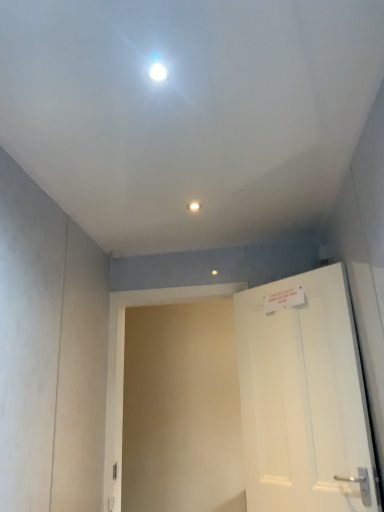
Describe the element at coordinates (194, 206) in the screenshot. I see `matte white light fixture at center` at that location.

Locate an element on the screen. This screenshot has height=512, width=384. matte white light fixture at center is located at coordinates (194, 206).

Image resolution: width=384 pixels, height=512 pixels. Describe the element at coordinates (304, 397) in the screenshot. I see `white matte door at right` at that location.

You are a GUI agent. You are given a task and a screenshot of the screen. Output one action in this format:
    pyautogui.click(x=<x>, y=<y>)
    Task: Click on the white matte door at right
    The height and width of the screenshot is (512, 384).
    Given the screenshot: What is the action you would take?
    pyautogui.click(x=304, y=397)

Locate an element on the screen. matte white light fixture at center is located at coordinates (194, 206).

Considering the relative positions of white matte door at right and matte white light fixture at center in the image provided, is white matte door at right to the left or to the right of matte white light fixture at center?

In the image, white matte door at right appears on the right side of matte white light fixture at center.

Looking at this image, which object is further away from the camera taking this photo, white matte door at right or matte white light fixture at center?

matte white light fixture at center.

Does point (340, 348) lie in front of point (195, 202)?

Yes.

From the image's perspective, is white matte door at right under matte white light fixture at center?

Correct, white matte door at right appears lower than matte white light fixture at center in the image.

From a real-world perspective, is white matte door at right physically below matte white light fixture at center?

Correct, in the physical world, white matte door at right is lower than matte white light fixture at center.

Which object is wider, white matte door at right or matte white light fixture at center?

white matte door at right.

In terms of height, does white matte door at right look taller or shorter compared to matte white light fixture at center?

Result: Clearly, white matte door at right is taller compared to matte white light fixture at center.

From the picture: Considering the sizes of objects white matte door at right and matte white light fixture at center in the image provided, who is bigger, white matte door at right or matte white light fixture at center?

Bigger between the two is white matte door at right.

Is matte white light fixture at center inside white matte door at right?

No, white matte door at right does not contain matte white light fixture at center.

Are white matte door at right and matte white light fixture at center far apart?

Indeed, white matte door at right is not near matte white light fixture at center.

Does white matte door at right turn towards matte white light fixture at center?

No, white matte door at right does not turn towards matte white light fixture at center.

Image resolution: width=384 pixels, height=512 pixels. I want to click on door in front of the matte white light fixture at center, so click(304, 397).

Which is more to the left, matte white light fixture at center or white matte door at right?

From the viewer's perspective, matte white light fixture at center appears more on the left side.

Is matte white light fixture at center positioned behind white matte door at right?

Yes, matte white light fixture at center is further from the viewer.

Does point (194, 204) lie in front of point (346, 413)?

No.

From the image's perspective, is matte white light fixture at center above white matte door at right?

Indeed, from the image's perspective, matte white light fixture at center is shown above white matte door at right.

From a real-world perspective, relative to white matte door at right, is matte white light fixture at center vertically above or below?

In terms of real-world spatial position, matte white light fixture at center is above white matte door at right.

Considering the relative sizes of matte white light fixture at center and white matte door at right in the image provided, is matte white light fixture at center thinner than white matte door at right?

Indeed, matte white light fixture at center has a lesser width compared to white matte door at right.

Is matte white light fixture at center taller than white matte door at right?

No, matte white light fixture at center is not taller than white matte door at right.

Does matte white light fixture at center have a larger size compared to white matte door at right?

No, matte white light fixture at center is not bigger than white matte door at right.

Is white matte door at right located within matte white light fixture at center?

No, matte white light fixture at center does not contain white matte door at right.

Is matte white light fixture at center with white matte door at right?

matte white light fixture at center is not next to white matte door at right, and they're not touching.

Does matte white light fixture at center turn towards white matte door at right?

No, matte white light fixture at center does not turn towards white matte door at right.

What's the angular difference between matte white light fixture at center and white matte door at right's facing directions?

There is a 45.7-degree angle between the facing directions of matte white light fixture at center and white matte door at right.

The image size is (384, 512). What are the coordinates of `door below the matte white light fixture at center (from a real-world perspective)` in the screenshot? It's located at (304, 397).

Where is `door that is in front of the matte white light fixture at center`? This screenshot has width=384, height=512. door that is in front of the matte white light fixture at center is located at coordinates (304, 397).

Locate an element on the screen. This screenshot has width=384, height=512. light fixture that is on the left side of white matte door at right is located at coordinates (194, 206).